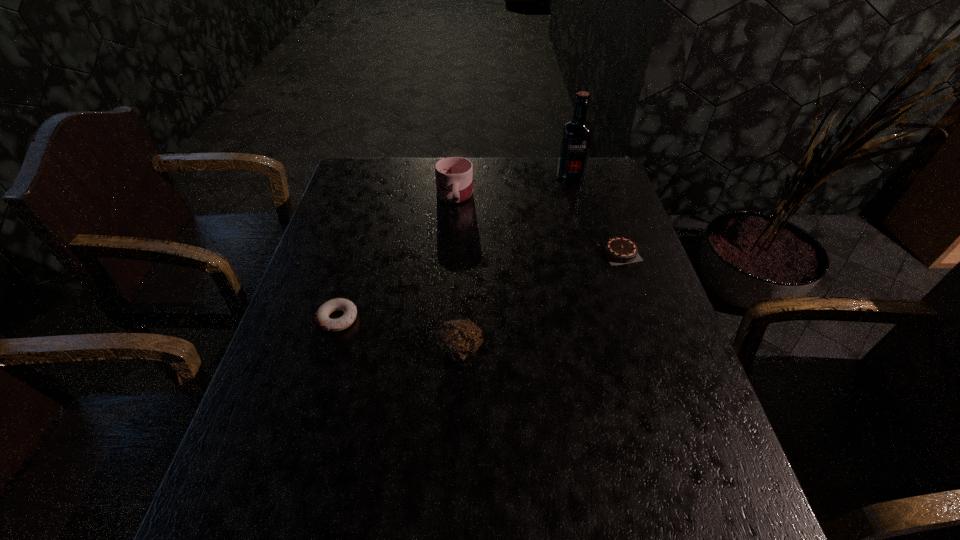
At what (x,y) coordinates should I click in order to perform the action: click on free space at the near right corner of the desktop. Please return your answer as a coordinate pair (x, y). Looking at the image, I should click on (743, 536).

The height and width of the screenshot is (540, 960). What are the coordinates of `vacant space in between the liquor and the chocolate cake` in the screenshot? It's located at (x=595, y=215).

Image resolution: width=960 pixels, height=540 pixels. Find the location of `empty space that is in between the doughnut and the mug`. empty space that is in between the doughnut and the mug is located at coordinates (396, 256).

Where is `empty location between the doughnut and the mug`? Image resolution: width=960 pixels, height=540 pixels. empty location between the doughnut and the mug is located at coordinates (396, 256).

The height and width of the screenshot is (540, 960). I want to click on vacant space that is in between the liquor and the muffin, so click(515, 264).

Where is `empty space that is in between the liquor and the chocolate cake`? The height and width of the screenshot is (540, 960). empty space that is in between the liquor and the chocolate cake is located at coordinates (595, 215).

Find the location of a particular element. unoccupied position between the second tallest object and the leftmost object is located at coordinates (396, 256).

The height and width of the screenshot is (540, 960). I want to click on vacant area between the fourth shortest object and the third tallest object, so click(x=457, y=272).

Image resolution: width=960 pixels, height=540 pixels. I want to click on blank region between the third nearest object and the tallest object, so click(595, 215).

This screenshot has height=540, width=960. Find the location of `vacant space that's between the third tallest object and the chocolate cake`. vacant space that's between the third tallest object and the chocolate cake is located at coordinates (540, 301).